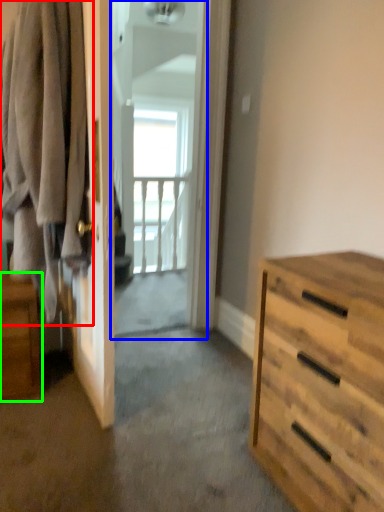
Question: Which object is the farthest from clothing (highlighted by a red box)? Choose among these: screen door (highlighted by a blue box) or nightstand (highlighted by a green box).

Choices:
 (A) screen door
 (B) nightstand

Answer: (A)